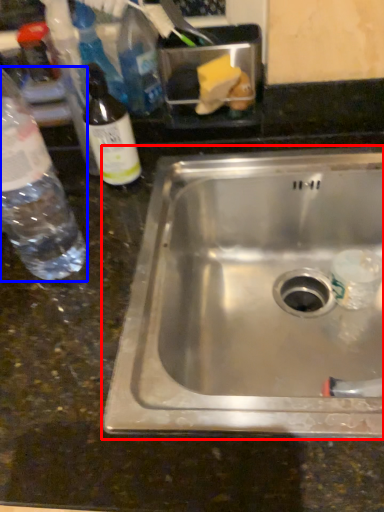
Question: Among these objects, which one is nearest to the camera, sink (highlighted by a red box) or bottle (highlighted by a blue box)?

Choices:
 (A) sink
 (B) bottle

Answer: (B)